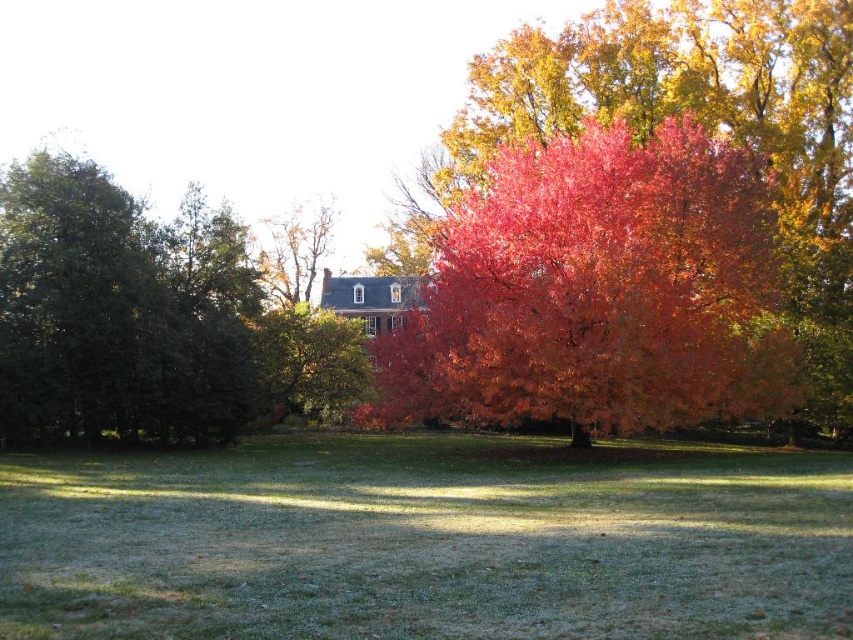
Question: Which point is closer to the camera?

Choices:
 (A) (521, 538)
 (B) (39, 333)
 (C) (659, 134)

Answer: (A)

Question: Does green grassy field at lower center have a larger size compared to green matte tree at left?

Choices:
 (A) no
 (B) yes

Answer: (A)

Question: Among these objects, which one is nearest to the camera?

Choices:
 (A) green matte tree at left
 (B) vivid red leaves at center

Answer: (B)

Question: Which object appears farthest from the camera in this image?

Choices:
 (A) green matte tree at left
 (B) vivid red leaves at center

Answer: (A)

Question: Is vivid red leaves at center positioned before green matte tree at left?

Choices:
 (A) yes
 (B) no

Answer: (A)

Question: Does green grassy field at lower center appear under vivid red leaves at center?

Choices:
 (A) yes
 (B) no

Answer: (A)